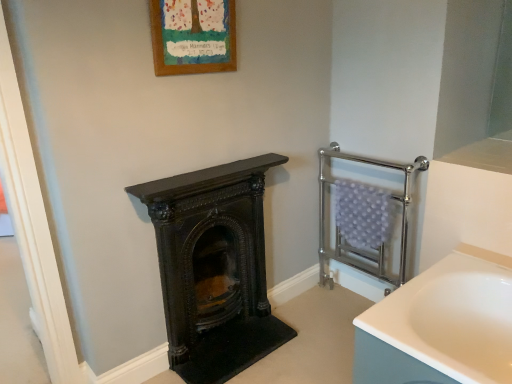
Question: From the image's perspective, would you say black polished wood burning stove at center is positioned over wooden frame at upper center?

Choices:
 (A) yes
 (B) no

Answer: (B)

Question: Is black polished wood burning stove at center positioned beyond the bounds of wooden frame at upper center?

Choices:
 (A) yes
 (B) no

Answer: (A)

Question: Can you confirm if black polished wood burning stove at center is thinner than wooden frame at upper center?

Choices:
 (A) yes
 (B) no

Answer: (B)

Question: Considering the relative sizes of black polished wood burning stove at center and wooden frame at upper center in the image provided, is black polished wood burning stove at center shorter than wooden frame at upper center?

Choices:
 (A) no
 (B) yes

Answer: (A)

Question: Is wooden frame at upper center at the back of black polished wood burning stove at center?

Choices:
 (A) yes
 (B) no

Answer: (B)

Question: Is black polished wood burning stove at center not near wooden frame at upper center?

Choices:
 (A) no
 (B) yes

Answer: (A)

Question: Is wooden frame at upper center located outside chrome metallic towel rack at right?

Choices:
 (A) no
 (B) yes

Answer: (B)

Question: Could you tell me if wooden frame at upper center is facing chrome metallic towel rack at right?

Choices:
 (A) no
 (B) yes

Answer: (A)

Question: Is wooden frame at upper center oriented away from chrome metallic towel rack at right?

Choices:
 (A) no
 (B) yes

Answer: (A)

Question: Does wooden frame at upper center have a greater height compared to chrome metallic towel rack at right?

Choices:
 (A) yes
 (B) no

Answer: (B)

Question: From the image's perspective, does wooden frame at upper center appear higher than chrome metallic towel rack at right?

Choices:
 (A) yes
 (B) no

Answer: (A)

Question: Is wooden frame at upper center behind chrome metallic towel rack at right?

Choices:
 (A) no
 (B) yes

Answer: (A)

Question: From a real-world perspective, is black polished wood burning stove at center below chrome metallic towel rack at right?

Choices:
 (A) yes
 (B) no

Answer: (A)